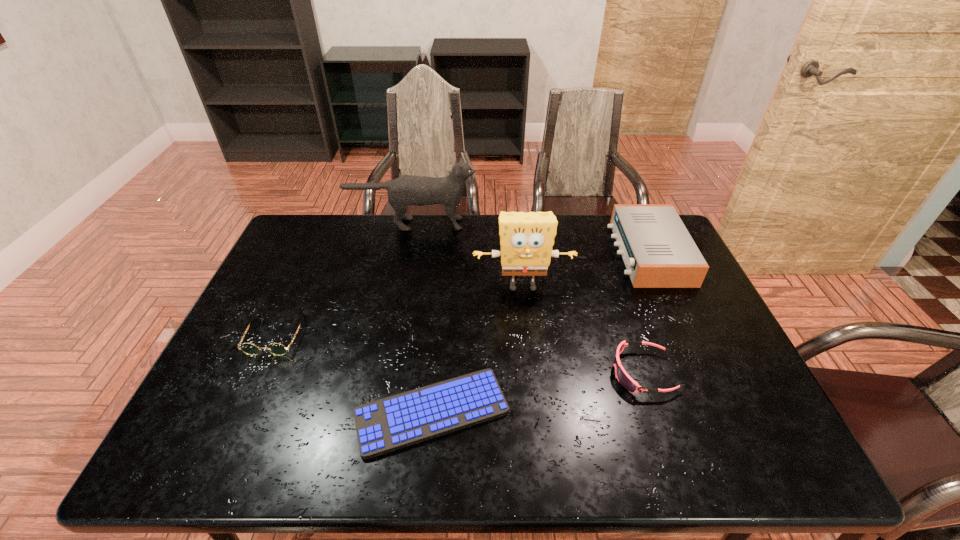
Locate an element on the screen. vacant area in the image that satisfies the following two spatial constraints: 1. on the front-facing side of the cat; 2. on the lenses of the leftmost object is located at coordinates (390, 335).

Identify the location of vacant area that satisfies the following two spatial constraints: 1. on the front-facing side of the cat; 2. on the back side of the shortest object. (374, 412).

In order to click on free region that satisfies the following two spatial constraints: 1. on the control panel of the radio receiver; 2. on the lenses of the spectacles in this screenshot , I will do `click(685, 335)`.

The image size is (960, 540). What are the coordinates of `blank space that satisfies the following two spatial constraints: 1. on the front-facing side of the shortest object; 2. on the left side of the cat` in the screenshot? It's located at (374, 412).